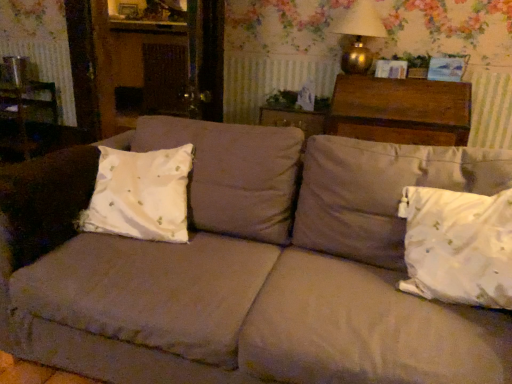
Question: Does white satin pillow at lower right, the 2th pillow from the left, have a larger size compared to wooden picture frame at upper center?

Choices:
 (A) yes
 (B) no

Answer: (A)

Question: Considering the relative positions of white satin pillow at lower right, the 2th pillow from the left, and wooden picture frame at upper center in the image provided, is white satin pillow at lower right, the 2th pillow from the left, to the left of wooden picture frame at upper center from the viewer's perspective?

Choices:
 (A) no
 (B) yes

Answer: (A)

Question: From a real-world perspective, is white satin pillow at lower right, marked as the 1th pillow in a right-to-left arrangement, on wooden picture frame at upper center?

Choices:
 (A) yes
 (B) no

Answer: (B)

Question: Is white satin pillow at lower right, marked as the 1th pillow in a right-to-left arrangement, positioned behind wooden picture frame at upper center?

Choices:
 (A) yes
 (B) no

Answer: (B)

Question: Is white satin pillow at lower right, marked as the 1th pillow in a right-to-left arrangement, shorter than wooden picture frame at upper center?

Choices:
 (A) yes
 (B) no

Answer: (B)

Question: Is point (489, 241) positioned closer to the camera than point (446, 122)?

Choices:
 (A) closer
 (B) farther

Answer: (A)

Question: From a real-world perspective, is white satin pillow at lower right, the 2th pillow from the left, positioned above or below dark brown wood chest at upper right?

Choices:
 (A) above
 (B) below

Answer: (B)

Question: From the image's perspective, is white satin pillow at lower right, the 2th pillow from the left, located above or below dark brown wood chest at upper right?

Choices:
 (A) below
 (B) above

Answer: (A)

Question: Which is correct: white satin pillow at lower right, marked as the 1th pillow in a right-to-left arrangement, is inside dark brown wood chest at upper right, or outside of it?

Choices:
 (A) outside
 (B) inside

Answer: (A)

Question: From the image's perspective, is gold metallic table lamp at upper right positioned above or below dark brown wood chest at upper right?

Choices:
 (A) below
 (B) above

Answer: (B)

Question: In terms of width, does gold metallic table lamp at upper right look wider or thinner when compared to dark brown wood chest at upper right?

Choices:
 (A) thin
 (B) wide

Answer: (A)

Question: From a real-world perspective, is gold metallic table lamp at upper right above or below dark brown wood chest at upper right?

Choices:
 (A) below
 (B) above

Answer: (B)

Question: From their relative heights in the image, would you say gold metallic table lamp at upper right is taller or shorter than dark brown wood chest at upper right?

Choices:
 (A) tall
 (B) short

Answer: (B)

Question: Is beige fabric couch at center taller or shorter than white cotton pillow at left, the second pillow positioned from the right?

Choices:
 (A) short
 (B) tall

Answer: (B)

Question: Is beige fabric couch at center spatially inside white cotton pillow at left, the second pillow positioned from the right, or outside of it?

Choices:
 (A) inside
 (B) outside

Answer: (B)